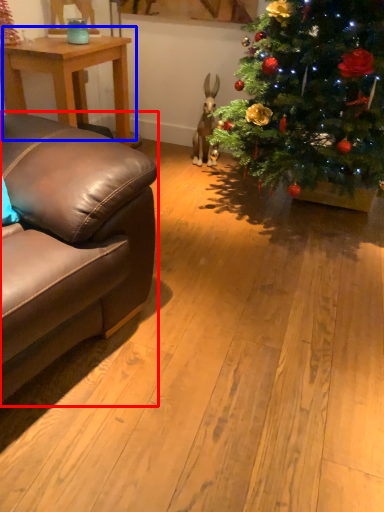
Question: Which point is further to the camera, studio couch (highlighted by a red box) or table (highlighted by a blue box)?

Choices:
 (A) studio couch
 (B) table

Answer: (B)